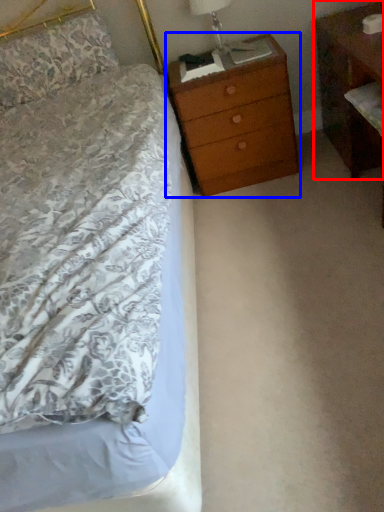
Question: Among these objects, which one is nearest to the camera, nightstand (highlighted by a red box) or chest of drawers (highlighted by a blue box)?

Choices:
 (A) nightstand
 (B) chest of drawers

Answer: (A)